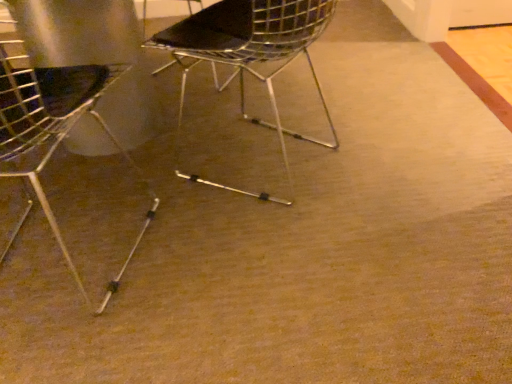
Image resolution: width=512 pixels, height=384 pixels. Describe the element at coordinates (54, 126) in the screenshot. I see `metallic wire chair at left, the second chair positioned from the right` at that location.

Measure the distance between metallic wire chair at left, the first chair when ordered from left to right, and camera.

metallic wire chair at left, the first chair when ordered from left to right, and camera are 79.45 centimeters apart.

I want to click on metallic wire chair at left, the first chair when ordered from left to right, so click(x=54, y=126).

What do you see at coordinates (247, 55) in the screenshot? I see `metallic wire chair at center, the 1th chair from the right` at bounding box center [247, 55].

You are a GUI agent. You are given a task and a screenshot of the screen. Output one action in this format:
    pyautogui.click(x=<x>, y=<y>)
    Task: Click on the metallic wire chair at center, which is the second chair in left-to-right order
    
    Given the screenshot: What is the action you would take?
    pyautogui.click(x=247, y=55)

Where is `metallic wire chair at left, the first chair when ordered from left to right`? metallic wire chair at left, the first chair when ordered from left to right is located at coordinates (54, 126).

Based on the photo, can you confirm if metallic wire chair at left, the first chair when ordered from left to right, is positioned to the left of metallic wire chair at center, which is the second chair in left-to-right order?

Yes, metallic wire chair at left, the first chair when ordered from left to right, is to the left of metallic wire chair at center, which is the second chair in left-to-right order.

Is metallic wire chair at left, the second chair positioned from the right, closer to the viewer compared to metallic wire chair at center, the 1th chair from the right?

Yes, it is.

Between point (20, 62) and point (313, 18), which one is positioned behind?

The point (20, 62) is more distant.

From the image's perspective, would you say metallic wire chair at left, the second chair positioned from the right, is shown under metallic wire chair at center, which is the second chair in left-to-right order?

Yes.

From a real-world perspective, is metallic wire chair at left, the second chair positioned from the right, over metallic wire chair at center, which is the second chair in left-to-right order?

Correct, in the physical world, metallic wire chair at left, the second chair positioned from the right, is higher than metallic wire chair at center, which is the second chair in left-to-right order.

Is metallic wire chair at left, the second chair positioned from the right, wider or thinner than metallic wire chair at center, which is the second chair in left-to-right order?

metallic wire chair at left, the second chair positioned from the right, is thinner than metallic wire chair at center, which is the second chair in left-to-right order.

Is metallic wire chair at left, the second chair positioned from the right, taller than metallic wire chair at center, which is the second chair in left-to-right order?

Yes.

Between metallic wire chair at left, the first chair when ordered from left to right, and metallic wire chair at center, which is the second chair in left-to-right order, which one has larger size?

With larger size is metallic wire chair at left, the first chair when ordered from left to right.

Is metallic wire chair at left, the second chair positioned from the right, surrounding metallic wire chair at center, which is the second chair in left-to-right order?

No, metallic wire chair at center, which is the second chair in left-to-right order, is not a part of metallic wire chair at left, the second chair positioned from the right.

Would you consider metallic wire chair at left, the first chair when ordered from left to right, to be distant from metallic wire chair at center, which is the second chair in left-to-right order?

No.

Is metallic wire chair at left, the first chair when ordered from left to right, looking in the opposite direction of metallic wire chair at center, which is the second chair in left-to-right order?

No.

How much distance is there between metallic wire chair at left, the first chair when ordered from left to right, and metallic wire chair at center, the 1th chair from the right?

metallic wire chair at left, the first chair when ordered from left to right, is 20.17 inches away from metallic wire chair at center, the 1th chair from the right.

Where is `chair behind the metallic wire chair at left, the first chair when ordered from left to right`? The image size is (512, 384). chair behind the metallic wire chair at left, the first chair when ordered from left to right is located at coordinates (247, 55).

Is metallic wire chair at center, which is the second chair in left-to-right order, at the left side of metallic wire chair at left, the first chair when ordered from left to right?

No, metallic wire chair at center, which is the second chair in left-to-right order, is not to the left of metallic wire chair at left, the first chair when ordered from left to right.

Is the depth of metallic wire chair at center, which is the second chair in left-to-right order, less than that of metallic wire chair at left, the second chair positioned from the right?

No, metallic wire chair at center, which is the second chair in left-to-right order, is behind metallic wire chair at left, the second chair positioned from the right.

Is point (233, 23) more distant than point (68, 86)?

Yes.

From the image's perspective, who appears lower, metallic wire chair at center, which is the second chair in left-to-right order, or metallic wire chair at left, the second chair positioned from the right?

metallic wire chair at left, the second chair positioned from the right, is shown below in the image.

From a real-world perspective, is metallic wire chair at center, the 1th chair from the right, physically located above or below metallic wire chair at left, the second chair positioned from the right?

metallic wire chair at center, the 1th chair from the right, is situated lower than metallic wire chair at left, the second chair positioned from the right, in the real world.

Can you confirm if metallic wire chair at center, which is the second chair in left-to-right order, is wider than metallic wire chair at left, the second chair positioned from the right?

Correct, the width of metallic wire chair at center, which is the second chair in left-to-right order, exceeds that of metallic wire chair at left, the second chair positioned from the right.

Who is taller, metallic wire chair at center, the 1th chair from the right, or metallic wire chair at left, the second chair positioned from the right?

Standing taller between the two is metallic wire chair at left, the second chair positioned from the right.

Between metallic wire chair at center, which is the second chair in left-to-right order, and metallic wire chair at left, the second chair positioned from the right, which one has larger size?

metallic wire chair at left, the second chair positioned from the right.

Is metallic wire chair at center, which is the second chair in left-to-right order, not inside metallic wire chair at left, the second chair positioned from the right?

Yes, metallic wire chair at center, which is the second chair in left-to-right order, is not within metallic wire chair at left, the second chair positioned from the right.

Is the surface of metallic wire chair at center, which is the second chair in left-to-right order, in direct contact with metallic wire chair at left, the first chair when ordered from left to right?

No, metallic wire chair at center, which is the second chair in left-to-right order, is not making contact with metallic wire chair at left, the first chair when ordered from left to right.

Is metallic wire chair at center, which is the second chair in left-to-right order, looking in the opposite direction of metallic wire chair at left, the first chair when ordered from left to right?

No, metallic wire chair at left, the first chair when ordered from left to right, is not at the back of metallic wire chair at center, which is the second chair in left-to-right order.

How much distance is there between metallic wire chair at center, the 1th chair from the right, and metallic wire chair at left, the first chair when ordered from left to right?

The distance of metallic wire chair at center, the 1th chair from the right, from metallic wire chair at left, the first chair when ordered from left to right, is 20.17 inches.

Image resolution: width=512 pixels, height=384 pixels. In order to click on chair below the metallic wire chair at center, which is the second chair in left-to-right order (from the image's perspective) in this screenshot , I will do `click(54, 126)`.

You are a GUI agent. You are given a task and a screenshot of the screen. Output one action in this format:
    pyautogui.click(x=<x>, y=<y>)
    Task: Click on the chair that appears above the metallic wire chair at center, which is the second chair in left-to-right order (from a real-world perspective)
    Image resolution: width=512 pixels, height=384 pixels.
    Given the screenshot: What is the action you would take?
    pyautogui.click(x=54, y=126)

Locate an element on the screen. chair in front of the metallic wire chair at center, the 1th chair from the right is located at coordinates (54, 126).